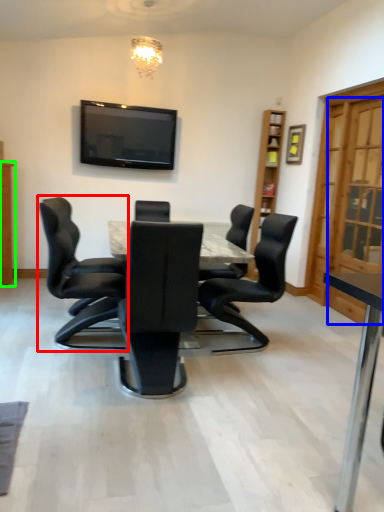
Question: Considering the real-world distances, which object is closest to chair (highlighted by a red box)? glass door (highlighted by a blue box) or cabinetry (highlighted by a green box).

Choices:
 (A) glass door
 (B) cabinetry

Answer: (B)